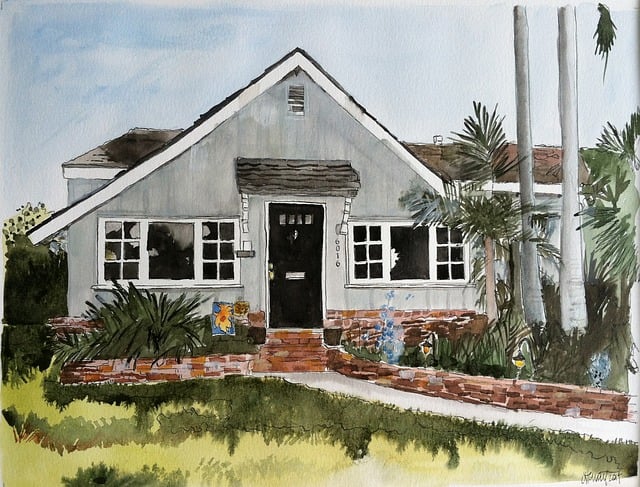
This screenshot has height=487, width=640. I want to click on painting, so click(301, 272).